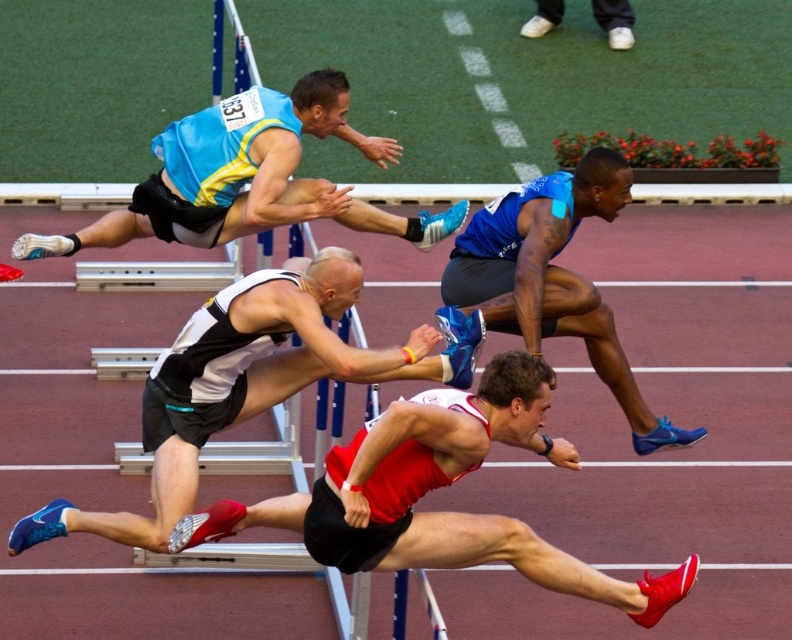
Question: Does matte blue singlet at upper center have a larger size compared to white matte shoes at upper center?

Choices:
 (A) yes
 (B) no

Answer: (A)

Question: Which object is the closest to the white matte shoes at upper center?

Choices:
 (A) matte blue singlet at upper center
 (B) blue matte shorts at center
 (C) red matte running shoe at center
 (D) white and black athletic shorts at center

Answer: (A)

Question: Is matte blue singlet at upper center bigger than blue matte shorts at center?

Choices:
 (A) yes
 (B) no

Answer: (A)

Question: Which of the following is the closest to the observer?

Choices:
 (A) (212, 349)
 (B) (402, 236)

Answer: (A)

Question: Which of these objects is positioned closest to the matte blue singlet at upper center?

Choices:
 (A) red matte running shoe at center
 (B) blue matte shorts at center
 (C) white matte shoes at upper center
 (D) white and black athletic shorts at center

Answer: (B)

Question: Can you confirm if red matte running shoe at center is wider than white and black athletic shorts at center?

Choices:
 (A) no
 (B) yes

Answer: (B)